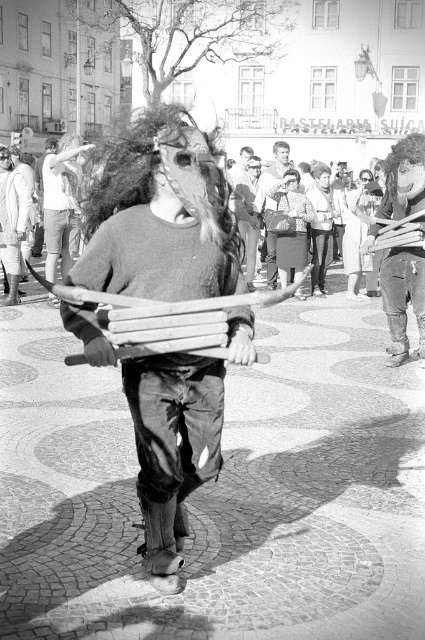
Looking at this image, you are a photographer standing in the middle of the street scene. You want to take a photo of the smooth leather jacket at center and the smooth brown leather bag at center. Which object should you focus on first if you want to capture both in the same frame without moving the camera?

The smooth leather jacket at center is positioned under the smooth brown leather bag at center, so you should focus on the smooth brown leather bag at center first to ensure both are in the frame.

You are a performer holding the wooden stick at center and the smooth brown leather bag at center. Which object is wider?

The wooden stick at center is wider than the smooth brown leather bag at center.